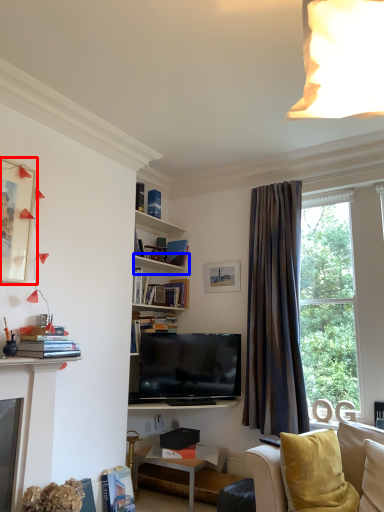
Question: Among these objects, which one is nearest to the camera, picture frame (highlighted by a red box) or shelf (highlighted by a blue box)?

Choices:
 (A) picture frame
 (B) shelf

Answer: (A)